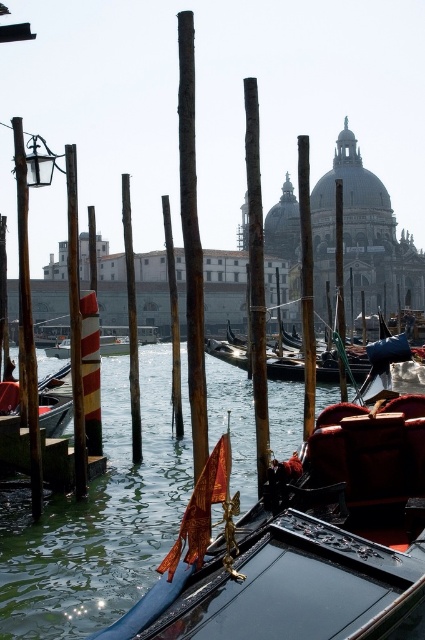
Looking at this image, can you confirm if wooden gondola at center is positioned below smooth wooden pole at center?

Correct, wooden gondola at center is located below smooth wooden pole at center.

Does wooden gondola at center have a lesser width compared to smooth wooden pole at center?

Incorrect, wooden gondola at center's width is not less than smooth wooden pole at center's.

Is point (212, 353) farther from viewer compared to point (308, 234)?

Yes, point (212, 353) is farther from viewer.

This screenshot has height=640, width=425. I want to click on wooden gondola at center, so click(x=377, y=355).

Is wooden pole at left below orange striped pole at center?

Correct, wooden pole at left is located below orange striped pole at center.

Can you confirm if wooden pole at left is thinner than orange striped pole at center?

Yes.

Locate an element on the screen. wooden pole at left is located at coordinates (74, 323).

Identify the location of wooden pole at left. The height and width of the screenshot is (640, 425). (74, 323).

Which is in front, point (67, 406) or point (339, 300)?

Point (67, 406) is more forward.

Does wooden gondola at left appear over smooth wood pole at center?

Actually, wooden gondola at left is below smooth wood pole at center.

Which is behind, point (42, 394) or point (334, 250)?

Positioned behind is point (334, 250).

At what (x,y) coordinates should I click in order to perform the action: click on wooden gondola at left. Please return your answer as a coordinate pair (x, y). The image size is (425, 640). Looking at the image, I should click on (54, 401).